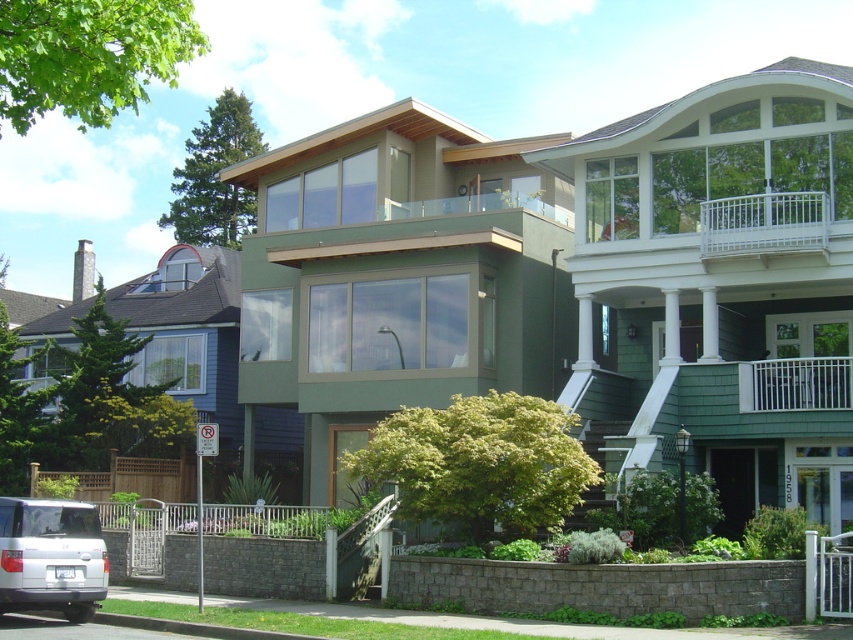
Is point (9, 598) farther from camera compared to point (776, 232)?

No, (9, 598) is closer to viewer.

Consider the image. Does white matte suv at lower left appear over white wooden railing at upper right?

Actually, white matte suv at lower left is below white wooden railing at upper right.

Where is `white matte suv at lower left`? The height and width of the screenshot is (640, 853). white matte suv at lower left is located at coordinates (51, 557).

Can you confirm if white wooden railing at upper right is shorter than white metal railing at upper right?

No.

Consider the image. Is white wooden railing at upper right to the left of white metal railing at upper right from the viewer's perspective?

Indeed, white wooden railing at upper right is positioned on the left side of white metal railing at upper right.

Between point (767, 250) and point (844, 396), which one is positioned behind?

Point (767, 250)

Identify the location of white wooden railing at upper right. (764, 224).

Based on the photo, can you confirm if white matte suv at lower left is bigger than white metal railing at upper right?

Yes, white matte suv at lower left is bigger than white metal railing at upper right.

Measure the distance between point (67, 522) and camera.

Point (67, 522) is 18.48 meters away from camera.

Locate an element on the screen. This screenshot has width=853, height=640. white matte suv at lower left is located at coordinates (51, 557).

The width and height of the screenshot is (853, 640). What are the coordinates of `white matte suv at lower left` in the screenshot? It's located at (51, 557).